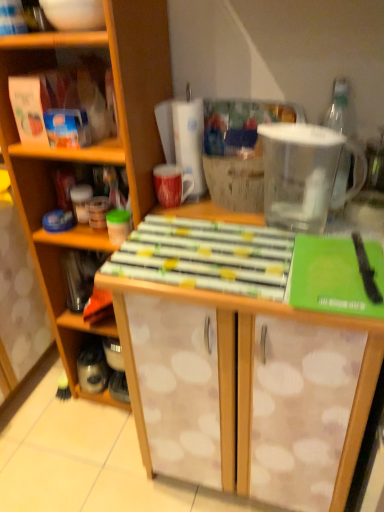
Question: Choose the correct answer: Is transparent plastic pitcher at upper right inside metallic silver container at left or outside it?

Choices:
 (A) outside
 (B) inside

Answer: (A)

Question: Considering the positions of point (x=317, y=210) and point (x=82, y=328), is point (x=317, y=210) closer or farther from the camera than point (x=82, y=328)?

Choices:
 (A) closer
 (B) farther

Answer: (A)

Question: Estimate the real-world distances between objects in this image. Which object is closer to the wooden table at center?

Choices:
 (A) transparent plastic pitcher at upper right
 (B) metallic silver container at left
 (C) white dotted wood cabinet at center

Answer: (A)

Question: Which is nearer to the transparent plastic pitcher at upper right?

Choices:
 (A) white dotted wood cabinet at center
 (B) wooden table at center
 (C) metallic silver container at left

Answer: (B)